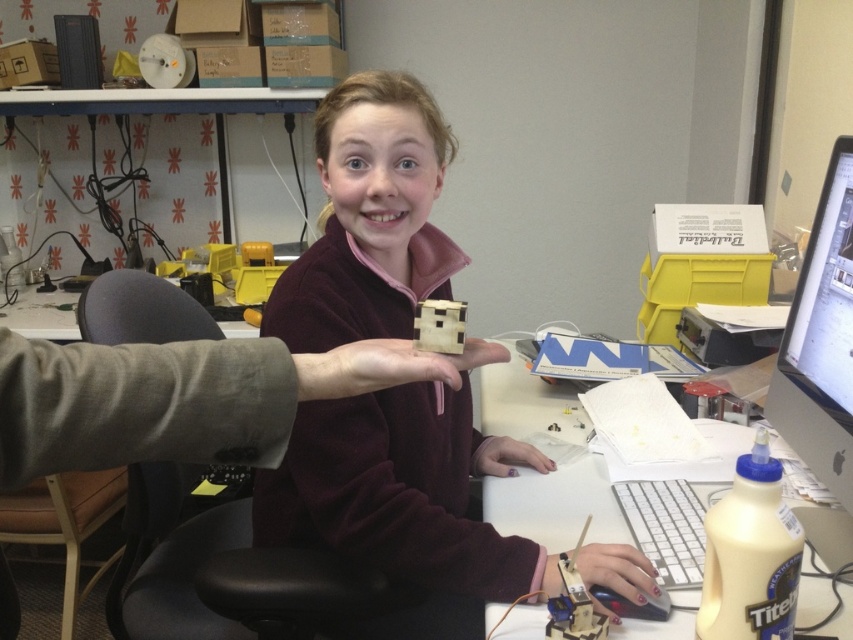
Between white plastic computer desk at center and matte black monitor at right, which one has more height?

With more height is matte black monitor at right.

Can you confirm if white plastic computer desk at center is positioned above matte black monitor at right?

Incorrect, white plastic computer desk at center is not positioned above matte black monitor at right.

Is point (604, 538) positioned after point (781, 372)?

No.

Where is `white plastic computer desk at center`? This screenshot has height=640, width=853. white plastic computer desk at center is located at coordinates (556, 504).

Can you confirm if wooden block at center is bigger than white plastic computer desk at center?

Indeed, wooden block at center has a larger size compared to white plastic computer desk at center.

Who is taller, wooden block at center or white plastic computer desk at center?

Standing taller between the two is wooden block at center.

Who is more forward, (318,538) or (543,426)?

Point (318,538)

Image resolution: width=853 pixels, height=640 pixels. In order to click on wooden block at center in this screenshot , I will do tap(405, 504).

Which is below, wooden block at center or matte black monitor at right?

wooden block at center

Is wooden block at center to the right of matte black monitor at right from the viewer's perspective?

Incorrect, wooden block at center is not on the right side of matte black monitor at right.

Which is in front, point (463, 564) or point (845, 355)?

Point (463, 564) is more forward.

I want to click on wooden block at center, so click(x=405, y=504).